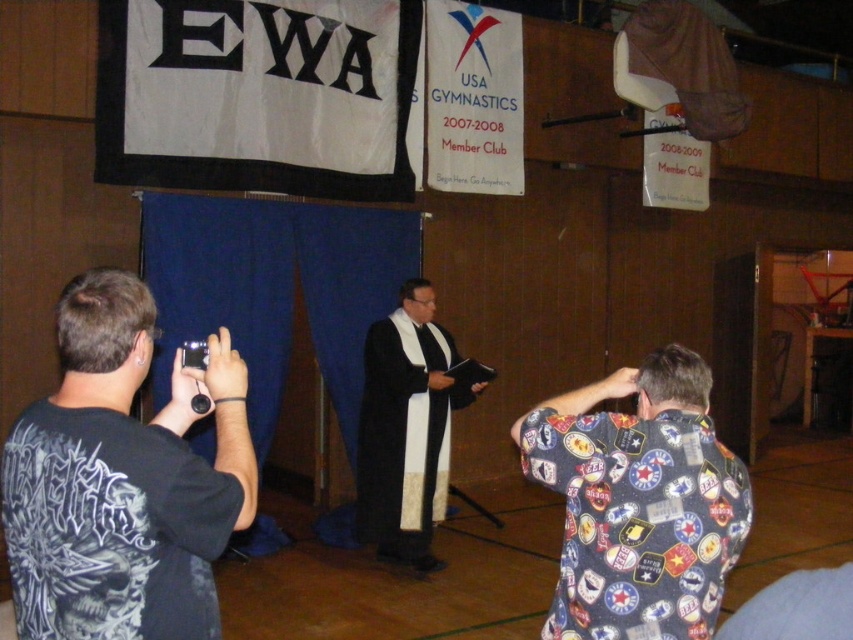
Based on the photo, is black matte shirt at left in front of printed patchwork shirt at right?

Yes, black matte shirt at left is closer to the viewer.

Is black matte shirt at left below printed patchwork shirt at right?

No.

Is point (125, 417) in front of point (613, 596)?

Yes, it is in front of point (613, 596).

I want to click on black matte shirt at left, so click(122, 480).

Between point (115, 304) and point (439, 445), which one is positioned in front?

Point (115, 304)

Can you confirm if black matte shirt at left is bigger than black matte robe at center?

No.

Does point (138, 358) come behind point (425, 298)?

That is False.

This screenshot has height=640, width=853. Identify the location of black matte shirt at left. (122, 480).

Between printed patchwork shirt at right and black matte robe at center, which one appears on the left side from the viewer's perspective?

black matte robe at center

Which is behind, point (636, 547) or point (369, 426)?

The point (369, 426) is more distant.

You are a GUI agent. You are given a task and a screenshot of the screen. Output one action in this format:
    pyautogui.click(x=<x>, y=<y>)
    Task: Click on the printed patchwork shirt at right
    The height and width of the screenshot is (640, 853).
    Given the screenshot: What is the action you would take?
    pyautogui.click(x=639, y=502)